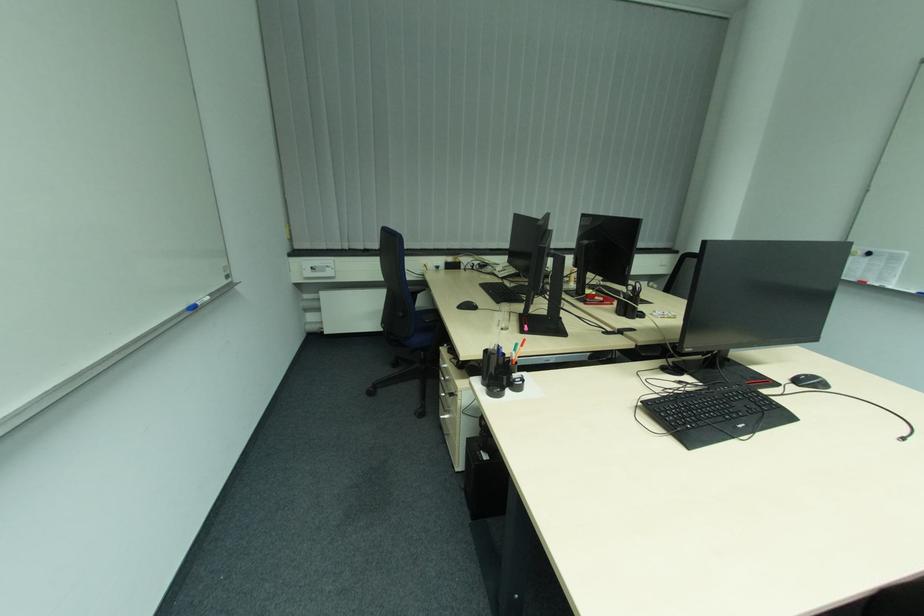
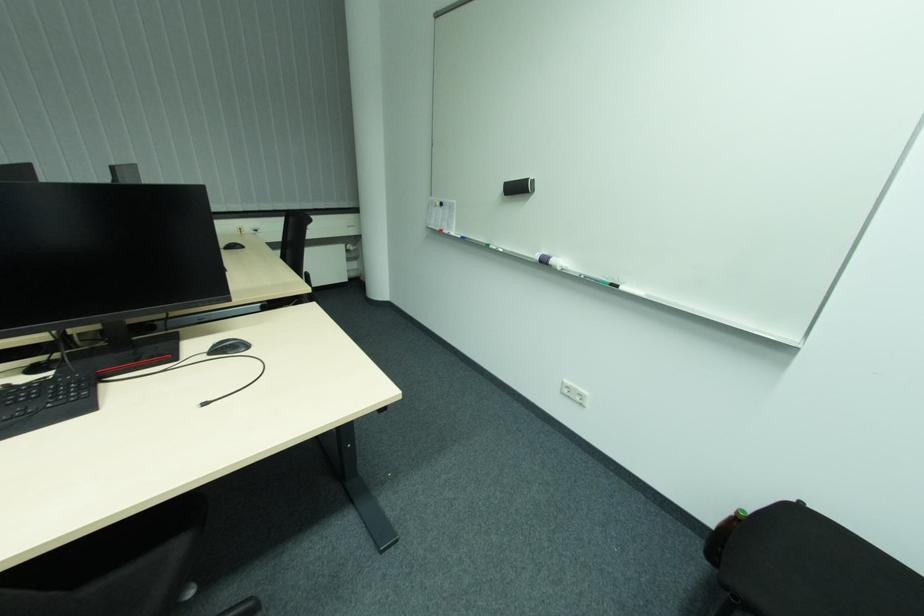
Question: In a continuous first-person perspective shot, in which direction is the camera moving?

Choices:
 (A) Left
 (B) Right
 (C) Forward
 (D) Backward

Answer: (B)